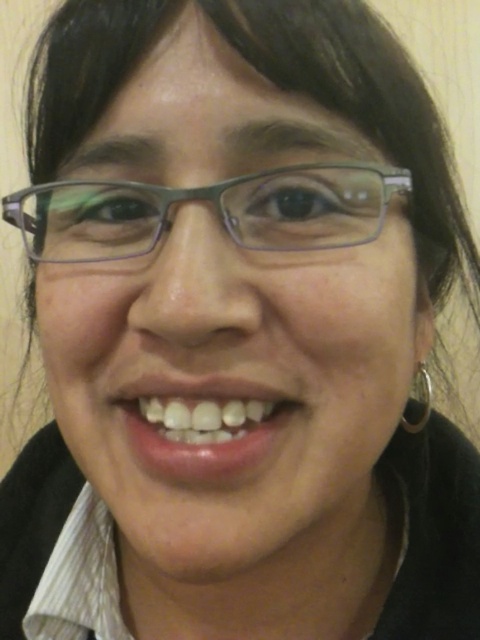
You are a photographer adjusting the lighting for a portrait. You notice the matte gray glasses at center and the silver metallic hoop at right. Which object is covering part of the other?

The matte gray glasses at center is positioned over the silver metallic hoop at right, so the glasses are covering part of the hoop.

You are a photographer adjusting the lighting for a portrait. You notice the matte gray glasses at center and the silver metallic hoop at right. Which object is closer to the camera lens based on their positions?

The matte gray glasses at center is in front of the silver metallic hoop at right, so the matte gray glasses at center is closer to the camera lens.

You are a photographer adjusting the camera focus. You need to ensure both the glossy pink lips at center and the silver metallic hoop at right are in focus. Which object should you focus on first to ensure both are sharp?

You should focus on the glossy pink lips at center first because it is above the silver metallic hoop at right, so focusing on the closer object will ensure both are in focus.